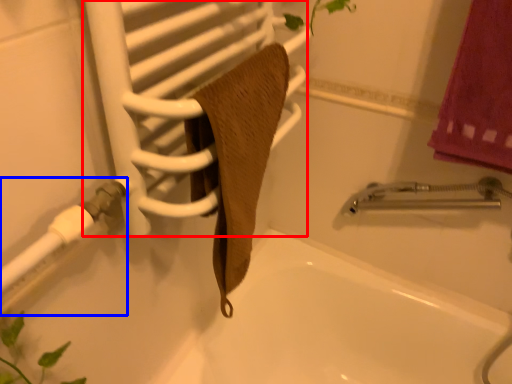
Question: Which of the following is the closest to the observer, screen door (highlighted by a red box) or shower (highlighted by a blue box)?

Choices:
 (A) screen door
 (B) shower

Answer: (A)